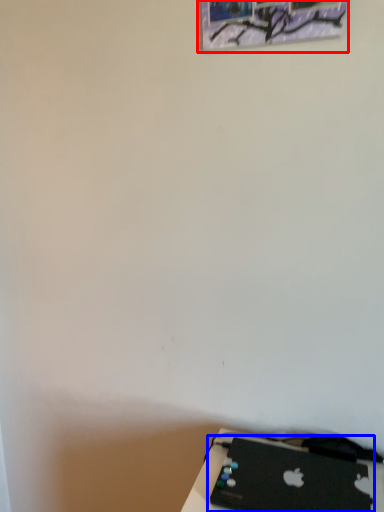
Question: Among these objects, which one is nearest to the camera, picture frame (highlighted by a red box) or laptop (highlighted by a blue box)?

Choices:
 (A) picture frame
 (B) laptop

Answer: (B)